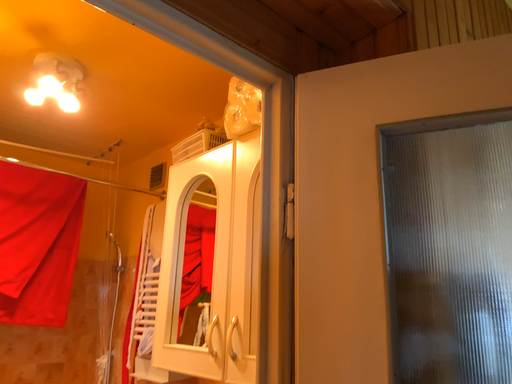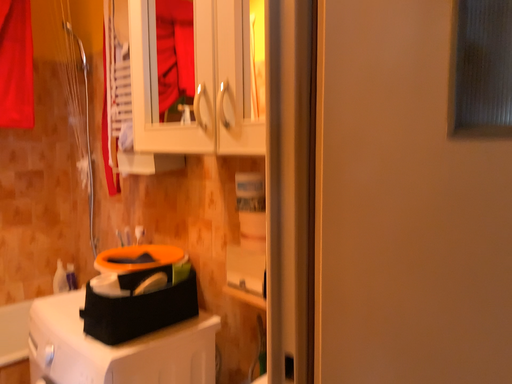
Question: How did the camera likely rotate when shooting the video?

Choices:
 (A) rotated downward
 (B) rotated upward

Answer: (A)